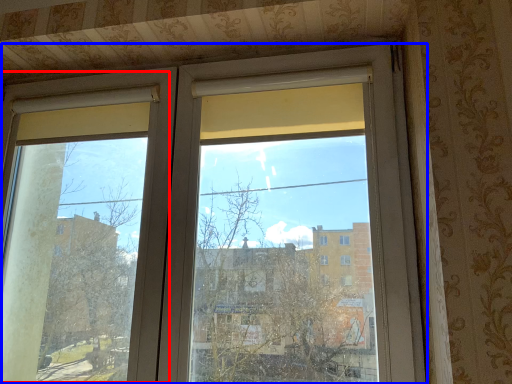
Question: Which of the following is the farthest to the observer, screen door (highlighted by a red box) or window (highlighted by a blue box)?

Choices:
 (A) screen door
 (B) window

Answer: (A)